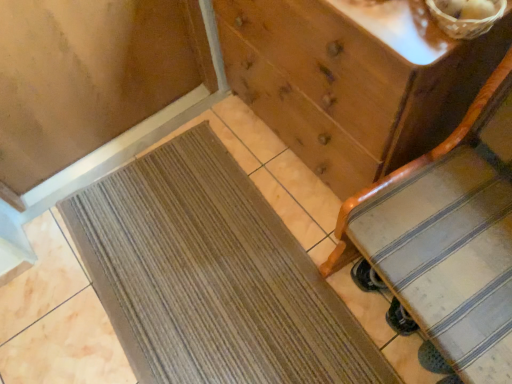
Question: Considering the relative sizes of brown woven basket at upper right and brown woven mat at lower left in the image provided, is brown woven basket at upper right taller than brown woven mat at lower left?

Choices:
 (A) no
 (B) yes

Answer: (B)

Question: Is brown woven basket at upper right touching brown woven mat at lower left?

Choices:
 (A) yes
 (B) no

Answer: (B)

Question: Does brown woven basket at upper right have a lesser width compared to brown woven mat at lower left?

Choices:
 (A) yes
 (B) no

Answer: (A)

Question: Is brown woven mat at lower left a part of brown woven basket at upper right?

Choices:
 (A) no
 (B) yes

Answer: (A)

Question: Is brown woven basket at upper right oriented away from brown woven mat at lower left?

Choices:
 (A) no
 (B) yes

Answer: (A)

Question: From a real-world perspective, is brown woven basket at upper right positioned over brown woven mat at lower left based on gravity?

Choices:
 (A) yes
 (B) no

Answer: (A)

Question: Is brown woven mat at lower left aimed at brown woven basket at upper right?

Choices:
 (A) no
 (B) yes

Answer: (A)

Question: From the image's perspective, is brown woven mat at lower left beneath brown woven basket at upper right?

Choices:
 (A) yes
 (B) no

Answer: (A)

Question: Can you see brown woven mat at lower left touching brown woven basket at upper right?

Choices:
 (A) yes
 (B) no

Answer: (B)

Question: From a real-world perspective, does brown woven mat at lower left stand above brown woven basket at upper right?

Choices:
 (A) yes
 (B) no

Answer: (B)

Question: Does brown woven mat at lower left have a smaller size compared to brown woven basket at upper right?

Choices:
 (A) no
 (B) yes

Answer: (A)

Question: Is brown woven mat at lower left taller than brown woven basket at upper right?

Choices:
 (A) yes
 (B) no

Answer: (B)

Question: Can you confirm if brown woven mat at lower left is positioned to the left of wooden chest of drawers at center?

Choices:
 (A) no
 (B) yes

Answer: (B)